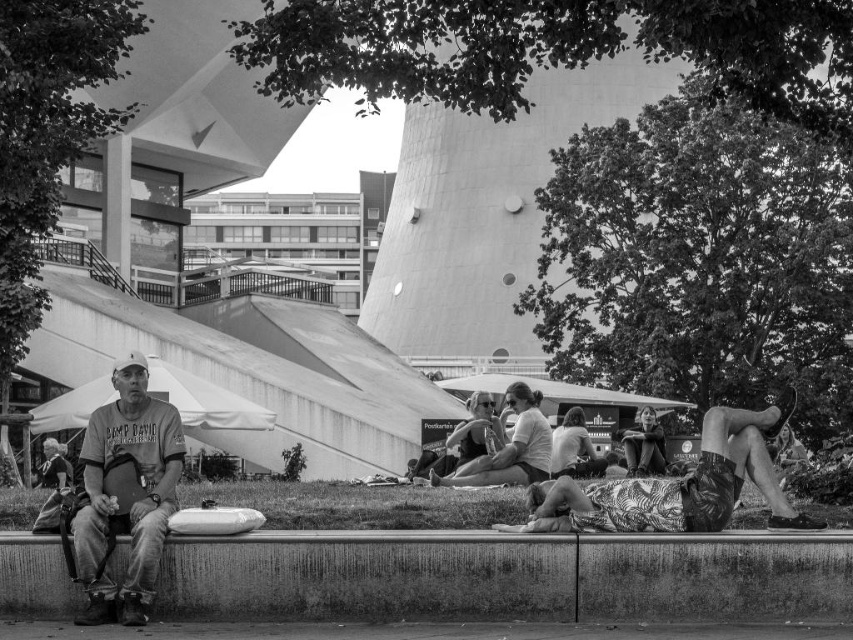
Locate an element on the screen. The image size is (853, 640). smooth concrete curb at lower center is located at coordinates [x=508, y=576].

Based on the photo, which is above, smooth concrete curb at lower center or printed fabric shorts at center?

printed fabric shorts at center

Locate an element on the screen. This screenshot has height=640, width=853. smooth concrete curb at lower center is located at coordinates (508, 576).

Is the position of matte gray t-shirt at left more distant than that of matte white shirt at center?

No.

Which is more to the left, matte gray t-shirt at left or matte white shirt at center?

matte gray t-shirt at left

Between point (106, 408) and point (541, 420), which one is positioned behind?

Positioned behind is point (541, 420).

What are the coordinates of `matte gray t-shirt at left` in the screenshot? It's located at [x=132, y=500].

Is point (791, 515) closer to viewer compared to point (155, 445)?

Yes, point (791, 515) is closer to viewer.

Who is lower down, printed fabric shorts at center or matte gray t-shirt at left?

Positioned lower is printed fabric shorts at center.

Image resolution: width=853 pixels, height=640 pixels. What are the coordinates of `printed fabric shorts at center` in the screenshot? It's located at (677, 484).